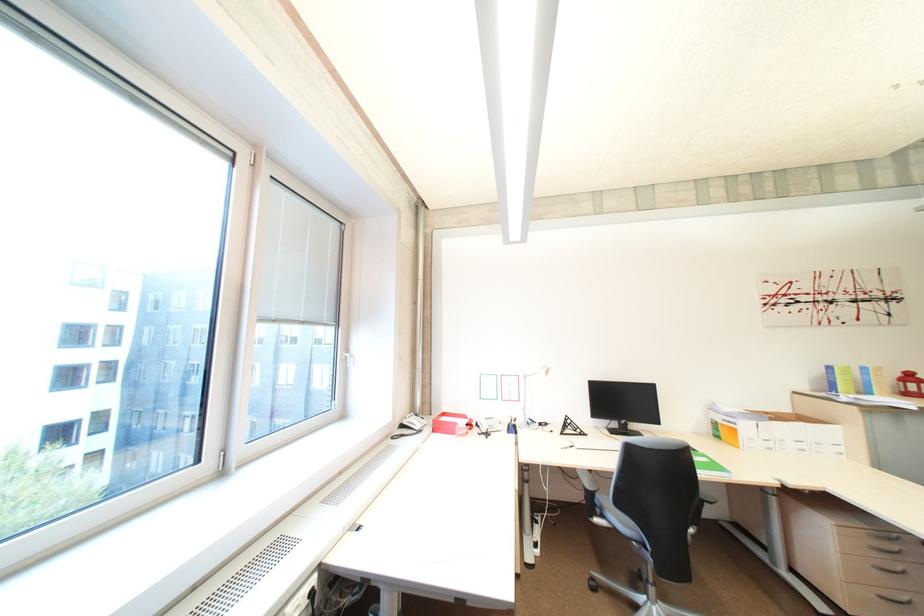
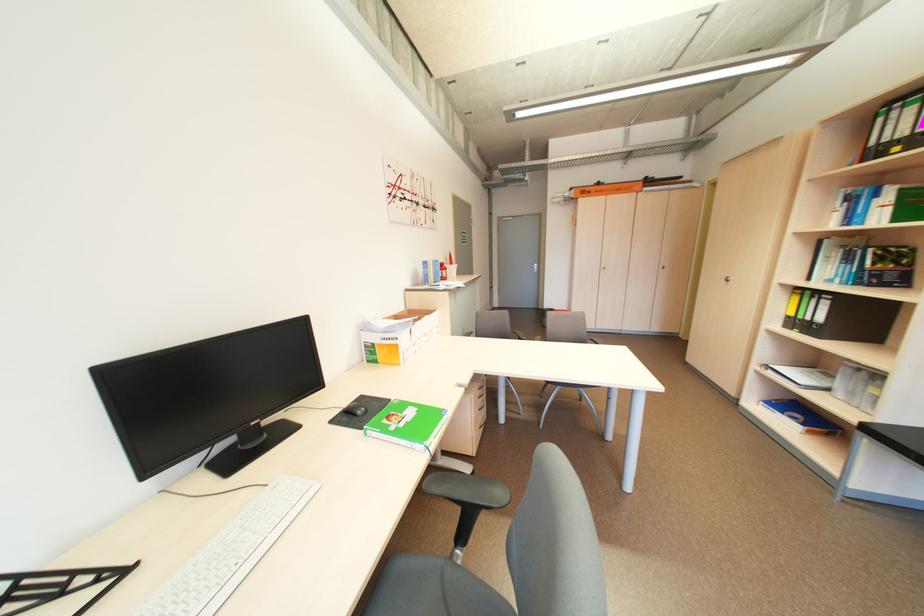
Find the pixel in the second image that matches the point at 745,431 in the first image.

(406, 347)